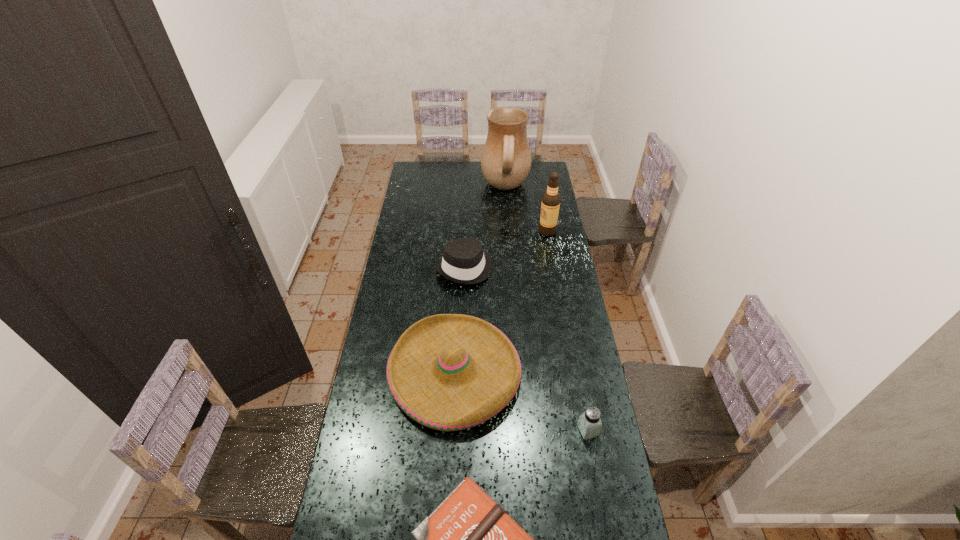
At what (x,y) coordinates should I click in order to perform the action: click on saltshaker present at the right edge. Please return your answer as a coordinate pair (x, y). This screenshot has height=540, width=960. Looking at the image, I should click on (589, 423).

At what (x,y) coordinates should I click in order to perform the action: click on object located at the far right corner. Please return your answer as a coordinate pair (x, y). This screenshot has height=540, width=960. Looking at the image, I should click on pos(506,159).

The width and height of the screenshot is (960, 540). Find the location of `free region at the far edge`. free region at the far edge is located at coordinates (469, 173).

Image resolution: width=960 pixels, height=540 pixels. Find the location of `free space at the left edge`. free space at the left edge is located at coordinates (364, 401).

I want to click on vacant space at the right edge of the desktop, so click(x=580, y=369).

Where is `free space at the far left corner`? This screenshot has height=540, width=960. free space at the far left corner is located at coordinates (420, 173).

Where is `free area in between the saltshaker and the fifth nearest object`? free area in between the saltshaker and the fifth nearest object is located at coordinates (567, 331).

I want to click on vacant point located between the saltshaker and the fifth nearest object, so click(567, 331).

Locate an element on the screen. Image resolution: width=960 pixels, height=540 pixels. vacant area that lies between the fourth nearest object and the second tallest object is located at coordinates (506, 250).

Image resolution: width=960 pixels, height=540 pixels. In order to click on unoccupied area between the alcohol and the sombrero in this screenshot , I will do 501,302.